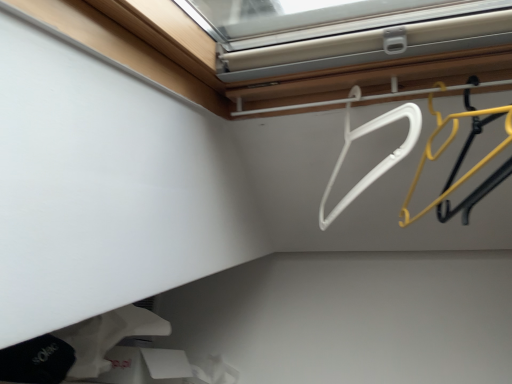
In order to face white plastic hanger at upper center, the second hanger when ordered from right to left, should I rotate leftwards or rightwards?

To align with it, rotate right about 12.923°.

Describe the element at coordinates (106, 337) in the screenshot. I see `white matte socks at lower left` at that location.

Where is `white plastic hanger at upper center, the first hanger positioned from the left`? The width and height of the screenshot is (512, 384). white plastic hanger at upper center, the first hanger positioned from the left is located at coordinates (380, 162).

Consider the image. Which is more to the left, yellow plastic hanger at upper right, the second hanger from the left, or white matte socks at lower left?

From the viewer's perspective, white matte socks at lower left appears more on the left side.

Measure the distance from yellow plastic hanger at upper right, the second hanger from the left, to white matte socks at lower left.

yellow plastic hanger at upper right, the second hanger from the left, and white matte socks at lower left are 29.12 inches apart.

What's the angular difference between yellow plastic hanger at upper right, the second hanger from the left, and white matte socks at lower left's facing directions?

The angular difference between yellow plastic hanger at upper right, the second hanger from the left, and white matte socks at lower left is 107 degrees.

From a real-world perspective, relative to white matte socks at lower left, is yellow plastic hanger at upper right, which is the 1th hanger in right-to-left order, vertically above or below?

Clearly, from a real-world perspective, yellow plastic hanger at upper right, which is the 1th hanger in right-to-left order, is above white matte socks at lower left.

Visually, is white plastic hanger at upper center, the second hanger when ordered from right to left, positioned to the left or to the right of white matte socks at lower left?

white plastic hanger at upper center, the second hanger when ordered from right to left, is to the right of white matte socks at lower left.

Is point (384, 161) closer or farther from the camera than point (75, 361)?

Point (384, 161) appears to be farther away from the viewer than point (75, 361).

Considering the relative sizes of white plastic hanger at upper center, the first hanger positioned from the left, and white matte socks at lower left in the image provided, is white plastic hanger at upper center, the first hanger positioned from the left, taller than white matte socks at lower left?

Yes, white plastic hanger at upper center, the first hanger positioned from the left, is taller than white matte socks at lower left.

From the picture: Considering the sizes of white plastic hanger at upper center, the first hanger positioned from the left, and white matte socks at lower left in the image, is white plastic hanger at upper center, the first hanger positioned from the left, bigger or smaller than white matte socks at lower left?

In the image, white plastic hanger at upper center, the first hanger positioned from the left, appears to be smaller than white matte socks at lower left.

How different are the orientations of white matte socks at lower left and white plastic hanger at upper center, the second hanger when ordered from right to left, in degrees?

The facing directions of white matte socks at lower left and white plastic hanger at upper center, the second hanger when ordered from right to left, are 114 degrees apart.

Is white matte socks at lower left smaller than white plastic hanger at upper center, the first hanger positioned from the left?

No, white matte socks at lower left is not smaller than white plastic hanger at upper center, the first hanger positioned from the left.

In the image, is white matte socks at lower left positioned in front of or behind white plastic hanger at upper center, the first hanger positioned from the left?

white matte socks at lower left is positioned farther from the viewer than white plastic hanger at upper center, the first hanger positioned from the left.

From a real-world perspective, which is physically above, white matte socks at lower left or white plastic hanger at upper center, the first hanger positioned from the left?

white plastic hanger at upper center, the first hanger positioned from the left, is physically above.

Does white matte socks at lower left lie behind yellow plastic hanger at upper right, which is the 1th hanger in right-to-left order?

That is True.

Is white matte socks at lower left situated inside yellow plastic hanger at upper right, the second hanger from the left, or outside?

white matte socks at lower left cannot be found inside yellow plastic hanger at upper right, the second hanger from the left.

In the scene shown: Which is more to the left, white matte socks at lower left or yellow plastic hanger at upper right, the second hanger from the left?

white matte socks at lower left.

The image size is (512, 384). What are the coordinates of `hanger below the white plastic hanger at upper center, the second hanger when ordered from right to left (from a real-world perspective)` in the screenshot? It's located at (462, 161).

In the scene shown: What's the angular difference between white plastic hanger at upper center, the second hanger when ordered from right to left, and yellow plastic hanger at upper right, which is the 1th hanger in right-to-left order,'s facing directions?

The angular difference between white plastic hanger at upper center, the second hanger when ordered from right to left, and yellow plastic hanger at upper right, which is the 1th hanger in right-to-left order, is 7.08 degrees.

From a real-world perspective, is white plastic hanger at upper center, the second hanger when ordered from right to left, physically located above or below yellow plastic hanger at upper right, which is the 1th hanger in right-to-left order?

In terms of real-world spatial position, white plastic hanger at upper center, the second hanger when ordered from right to left, is above yellow plastic hanger at upper right, which is the 1th hanger in right-to-left order.

Is white plastic hanger at upper center, the second hanger when ordered from right to left, bigger or smaller than yellow plastic hanger at upper right, the second hanger from the left?

white plastic hanger at upper center, the second hanger when ordered from right to left, is bigger than yellow plastic hanger at upper right, the second hanger from the left.

Which of these two, yellow plastic hanger at upper right, the second hanger from the left, or white plastic hanger at upper center, the first hanger positioned from the left, is bigger?

With larger size is white plastic hanger at upper center, the first hanger positioned from the left.

Is white plastic hanger at upper center, the second hanger when ordered from right to left, a part of yellow plastic hanger at upper right, the second hanger from the left?

No, white plastic hanger at upper center, the second hanger when ordered from right to left, is not surrounded by yellow plastic hanger at upper right, the second hanger from the left.

What are the coordinates of `hanger that is above the yellow plastic hanger at upper right, which is the 1th hanger in right-to-left order (from a real-world perspective)` in the screenshot? It's located at (380, 162).

From the image's perspective, is yellow plastic hanger at upper right, which is the 1th hanger in right-to-left order, located above white plastic hanger at upper center, the second hanger when ordered from right to left?

No, from the image's perspective, yellow plastic hanger at upper right, which is the 1th hanger in right-to-left order, is not on top of white plastic hanger at upper center, the second hanger when ordered from right to left.

This screenshot has height=384, width=512. Find the location of `clothing below the yellow plastic hanger at upper right, which is the 1th hanger in right-to-left order (from the image's perspective)`. clothing below the yellow plastic hanger at upper right, which is the 1th hanger in right-to-left order (from the image's perspective) is located at coordinates (106, 337).

Where is `hanger that is the 1st object located in front of the white matte socks at lower left`? This screenshot has height=384, width=512. hanger that is the 1st object located in front of the white matte socks at lower left is located at coordinates (380, 162).

From the image, which object appears to be farther from white matte socks at lower left, yellow plastic hanger at upper right, the second hanger from the left, or white plastic hanger at upper center, the second hanger when ordered from right to left?

Among the two, yellow plastic hanger at upper right, the second hanger from the left, is located further to white matte socks at lower left.

Which object lies nearer to the anchor point white plastic hanger at upper center, the first hanger positioned from the left, white matte socks at lower left or yellow plastic hanger at upper right, which is the 1th hanger in right-to-left order?

Among the two, yellow plastic hanger at upper right, which is the 1th hanger in right-to-left order, is located nearer to white plastic hanger at upper center, the first hanger positioned from the left.

Looking at the image, which one is located closer to white matte socks at lower left, white plastic hanger at upper center, the first hanger positioned from the left, or yellow plastic hanger at upper right, which is the 1th hanger in right-to-left order?

The object closer to white matte socks at lower left is white plastic hanger at upper center, the first hanger positioned from the left.

In the scene shown: Based on their spatial positions, is white matte socks at lower left or white plastic hanger at upper center, the second hanger when ordered from right to left, closer to yellow plastic hanger at upper right, which is the 1th hanger in right-to-left order?

white plastic hanger at upper center, the second hanger when ordered from right to left.

Looking at the image, which one is located further to white plastic hanger at upper center, the first hanger positioned from the left, yellow plastic hanger at upper right, the second hanger from the left, or white matte socks at lower left?

Based on the image, white matte socks at lower left appears to be further to white plastic hanger at upper center, the first hanger positioned from the left.

Which object lies nearer to the anchor point yellow plastic hanger at upper right, the second hanger from the left, white plastic hanger at upper center, the second hanger when ordered from right to left, or white matte socks at lower left?

white plastic hanger at upper center, the second hanger when ordered from right to left, is closer to yellow plastic hanger at upper right, the second hanger from the left.

The width and height of the screenshot is (512, 384). I want to click on hanger between white matte socks at lower left and yellow plastic hanger at upper right, which is the 1th hanger in right-to-left order, so click(x=380, y=162).